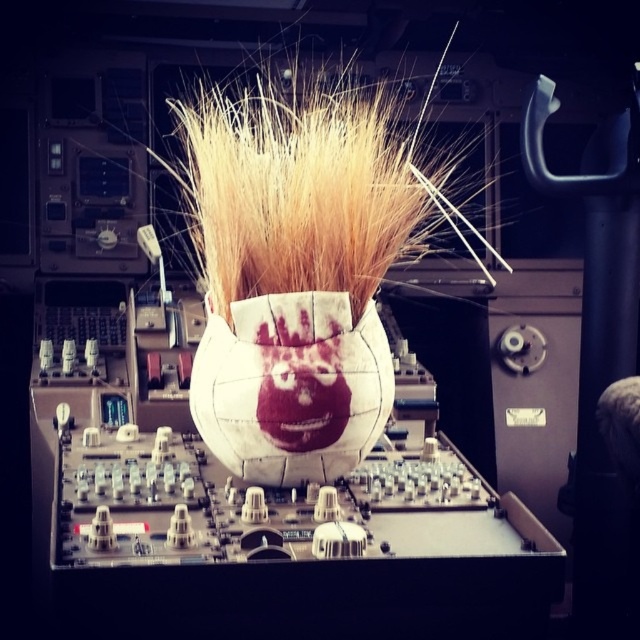
This screenshot has height=640, width=640. What do you see at coordinates (307, 184) in the screenshot? I see `golden straw hair at center` at bounding box center [307, 184].

Which of these two, golden straw hair at center or white fabric vase at center, stands taller?

golden straw hair at center

Which is in front, point (365, 131) or point (244, 440)?

Positioned in front is point (244, 440).

Locate an element on the screen. golden straw hair at center is located at coordinates (307, 184).